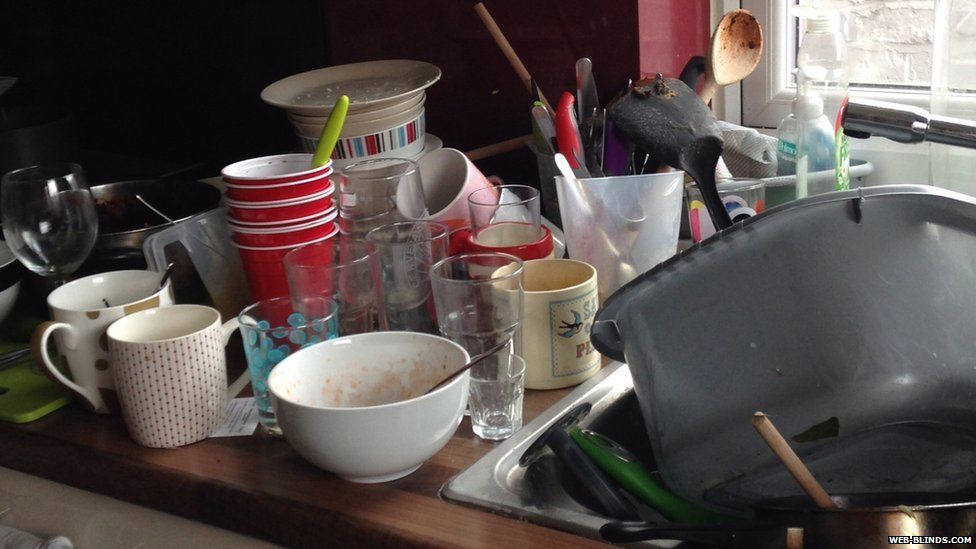
Image resolution: width=976 pixels, height=549 pixels. I want to click on basin, so click(852, 345).